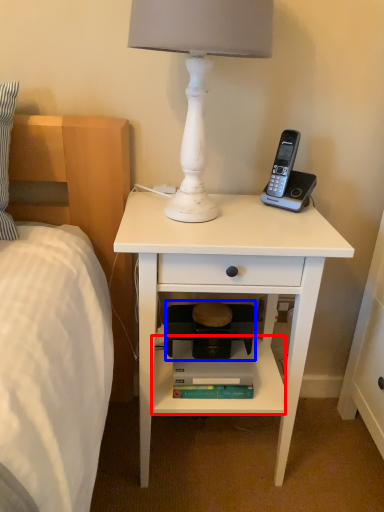
Question: Which of the following is the farthest to the observer, shelf (highlighted by a red box) or step stool (highlighted by a blue box)?

Choices:
 (A) shelf
 (B) step stool

Answer: (B)